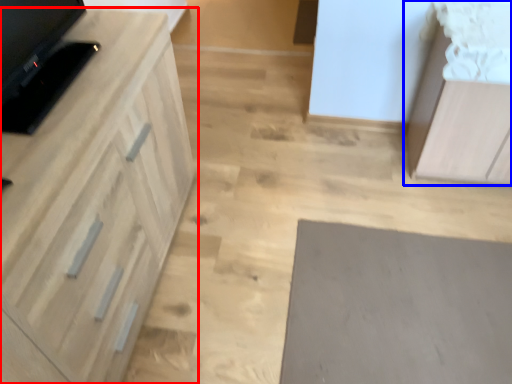
Question: Which object appears farthest to the camera in this image, cabinetry (highlighted by a red box) or cabinetry (highlighted by a blue box)?

Choices:
 (A) cabinetry
 (B) cabinetry

Answer: (B)